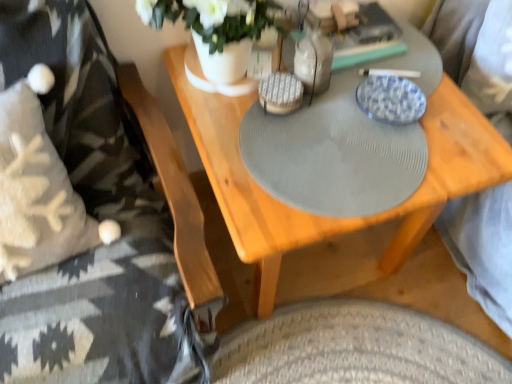
The image size is (512, 384). What do you see at coordinates (482, 251) in the screenshot? I see `wooden table at center` at bounding box center [482, 251].

Locate an element on the screen. The height and width of the screenshot is (384, 512). clear glass bottle at center is located at coordinates pos(313,58).

Considering the sizes of objects wooden table at center and clear glass bottle at center in the image provided, who is taller, wooden table at center or clear glass bottle at center?

With more height is wooden table at center.

How much distance is there between wooden table at center and clear glass bottle at center?

A distance of 10.67 inches exists between wooden table at center and clear glass bottle at center.

Could you tell me if wooden table at center is facing clear glass bottle at center?

No, wooden table at center is not turned towards clear glass bottle at center.

From the image's perspective, who appears lower, wooden table at center or clear glass bottle at center?

wooden table at center, from the image's perspective.

Considering the relative sizes of white matte vase at upper center and knitted wool blanket at left in the image provided, is white matte vase at upper center thinner than knitted wool blanket at left?

Yes.

Is white matte vase at upper center positioned far away from knitted wool blanket at left?

They are positioned close to each other.

From a real-world perspective, who is located higher, white matte vase at upper center or knitted wool blanket at left?

In real-world perspective, white matte vase at upper center is above.

What's the angular difference between white matte vase at upper center and knitted wool blanket at left's facing directions?

0.456 degrees.

Would you say blue glazed plate at upper center is a long distance from wooden table at center?

Actually, blue glazed plate at upper center and wooden table at center are a little close together.

In terms of height, does blue glazed plate at upper center look taller or shorter compared to wooden table at center?

Considering their sizes, blue glazed plate at upper center has less height than wooden table at center.

Which is in front, blue glazed plate at upper center or wooden table at center?

wooden table at center is closer to the camera.

Considering the sizes of objects white matte vase at upper center and clear glass bottle at center in the image provided, who is thinner, white matte vase at upper center or clear glass bottle at center?

Thinner between the two is clear glass bottle at center.

Which is more to the right, white matte vase at upper center or clear glass bottle at center?

clear glass bottle at center.

Is white matte vase at upper center aimed at clear glass bottle at center?

No, white matte vase at upper center is not turned towards clear glass bottle at center.

Looking at the image, does white matte vase at upper center seem bigger or smaller compared to clear glass bottle at center?

In the image, white matte vase at upper center appears to be larger than clear glass bottle at center.

From a real-world perspective, which is physically below, knitted wool blanket at left or white matte vase at upper center?

knitted wool blanket at left, from a real-world perspective.

Which object is thinner, knitted wool blanket at left or white matte vase at upper center?

With smaller width is white matte vase at upper center.

Is knitted wool blanket at left closer to the viewer compared to white matte vase at upper center?

Yes, it is in front of white matte vase at upper center.

In the scene shown: In the image, is knitted wool blanket at left positioned in front of or behind blue glazed plate at upper center?

knitted wool blanket at left is positioned closer to the viewer than blue glazed plate at upper center.

Locate an element on the screen. bedding lying below the blue glazed plate at upper center (from the image's perspective) is located at coordinates (98, 220).

From a real-world perspective, is knitted wool blanket at left on top of blue glazed plate at upper center?

Incorrect, from a real-world perspective, knitted wool blanket at left is lower than blue glazed plate at upper center.

How much distance is there between knitted wool blanket at left and blue glazed plate at upper center?

24.05 inches.

The width and height of the screenshot is (512, 384). Find the location of `bedding lying below the blue glazed plate at upper center (from the image's perspective)`. bedding lying below the blue glazed plate at upper center (from the image's perspective) is located at coordinates (98, 220).

Does blue glazed plate at upper center turn towards knitted wool blanket at left?

No, blue glazed plate at upper center does not turn towards knitted wool blanket at left.

Where is `table below the clear glass bottle at center (from a real-world perspective)`? This screenshot has height=384, width=512. table below the clear glass bottle at center (from a real-world perspective) is located at coordinates (482, 251).

Find the location of a particular element. The height and width of the screenshot is (384, 512). bedding that is in front of the white matte vase at upper center is located at coordinates (98, 220).

Looking at the image, which one is located closer to blue glazed plate at upper center, knitted wool blanket at left or clear glass bottle at center?

clear glass bottle at center is closer to blue glazed plate at upper center.

Based on their spatial positions, is white matte vase at upper center or wooden table at center closer to clear glass bottle at center?

white matte vase at upper center lies closer to clear glass bottle at center than the other object.

Which object lies further to the anchor point white matte vase at upper center, clear glass bottle at center or blue glazed plate at upper center?

The object further to white matte vase at upper center is blue glazed plate at upper center.

Estimate the real-world distances between objects in this image. Which object is closer to knitted wool blanket at left, clear glass bottle at center or white matte vase at upper center?

Based on the image, white matte vase at upper center appears to be nearer to knitted wool blanket at left.

Considering their positions, is knitted wool blanket at left positioned further to white matte vase at upper center than blue glazed plate at upper center?

Among the two, knitted wool blanket at left is located further to white matte vase at upper center.

Estimate the real-world distances between objects in this image. Which object is closer to wooden table at center, white matte vase at upper center or clear glass bottle at center?

The object closer to wooden table at center is white matte vase at upper center.

Looking at the image, which one is located further to blue glazed plate at upper center, clear glass bottle at center or wooden table at center?

wooden table at center is positioned further to the anchor blue glazed plate at upper center.

When comparing their distances from white matte vase at upper center, does knitted wool blanket at left or wooden table at center seem further?

Based on the image, knitted wool blanket at left appears to be further to white matte vase at upper center.

Find the location of a particular element. Image resolution: width=512 pixels, height=384 pixels. bottle between knitted wool blanket at left and wooden table at center in the horizontal direction is located at coordinates (313, 58).

Find the location of a particular element. Image resolution: width=512 pixels, height=384 pixels. table situated between knitted wool blanket at left and blue glazed plate at upper center from left to right is located at coordinates (482, 251).

This screenshot has height=384, width=512. What are the coordinates of `floral arrangement located between knitted wool blanket at left and wooden table at center in the left-right direction` in the screenshot? It's located at (217, 29).

Where is `bottle located between knitted wool blanket at left and blue glazed plate at upper center in the left-right direction`? bottle located between knitted wool blanket at left and blue glazed plate at upper center in the left-right direction is located at coordinates (313, 58).